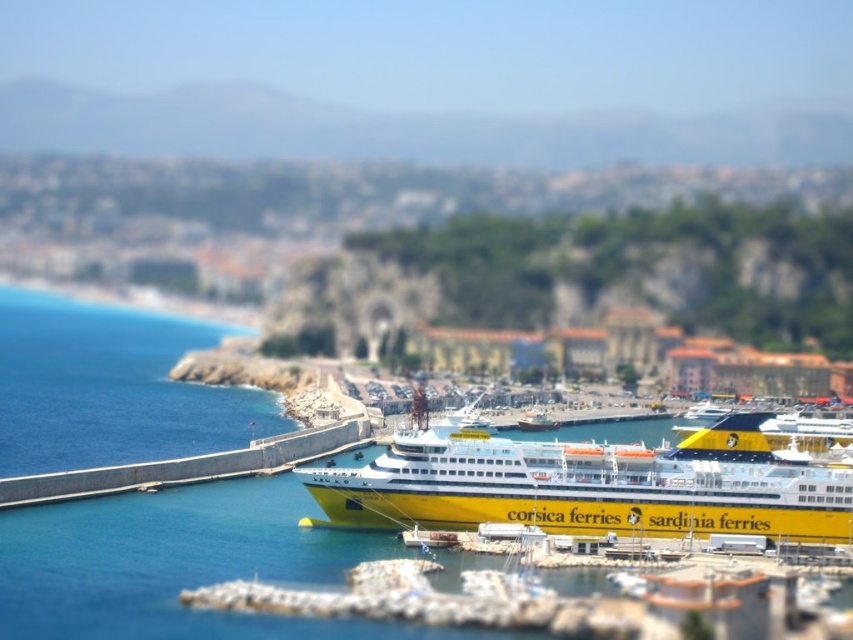
Does yellow matte/clear ferry at center appear on the right side of concrete wall at lower left?

Yes, yellow matte/clear ferry at center is to the right of concrete wall at lower left.

How far apart are yellow matte/clear ferry at center and concrete wall at lower left?

yellow matte/clear ferry at center and concrete wall at lower left are 69.73 meters apart.

Is point (845, 522) less distant than point (277, 449)?

Yes, it is in front of point (277, 449).

Image resolution: width=853 pixels, height=640 pixels. What are the coordinates of `yellow matte/clear ferry at center` in the screenshot? It's located at (590, 484).

The height and width of the screenshot is (640, 853). I want to click on yellow matte/clear ferry at center, so click(590, 484).

How far apart are yellow matte/clear ferry at center and yellow matte ferry at center?

yellow matte/clear ferry at center is 275.27 feet away from yellow matte ferry at center.

Between point (445, 436) and point (523, 422), which one is positioned in front?

Point (445, 436) is more forward.

Where is `yellow matte/clear ferry at center`? yellow matte/clear ferry at center is located at coordinates (590, 484).

Does concrete wall at lower left have a lesser height compared to yellow matte ferry at center?

In fact, concrete wall at lower left may be taller than yellow matte ferry at center.

Consider the image. Does concrete wall at lower left have a greater height compared to yellow matte ferry at center?

Correct, concrete wall at lower left is much taller as yellow matte ferry at center.

Between point (136, 484) and point (538, 412), which one is positioned behind?

The point (538, 412) is behind.

This screenshot has height=640, width=853. I want to click on concrete wall at lower left, so click(x=187, y=465).